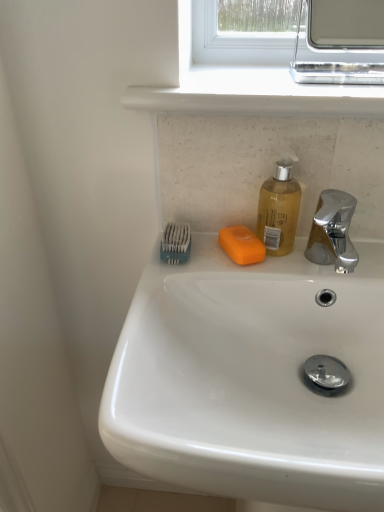
At what (x,y) coordinates should I click in order to perform the action: click on empty space that is to the right of orange matte soap at center. Please return your answer as a coordinate pair (x, y). The image size is (384, 512). Looking at the image, I should click on (330, 261).